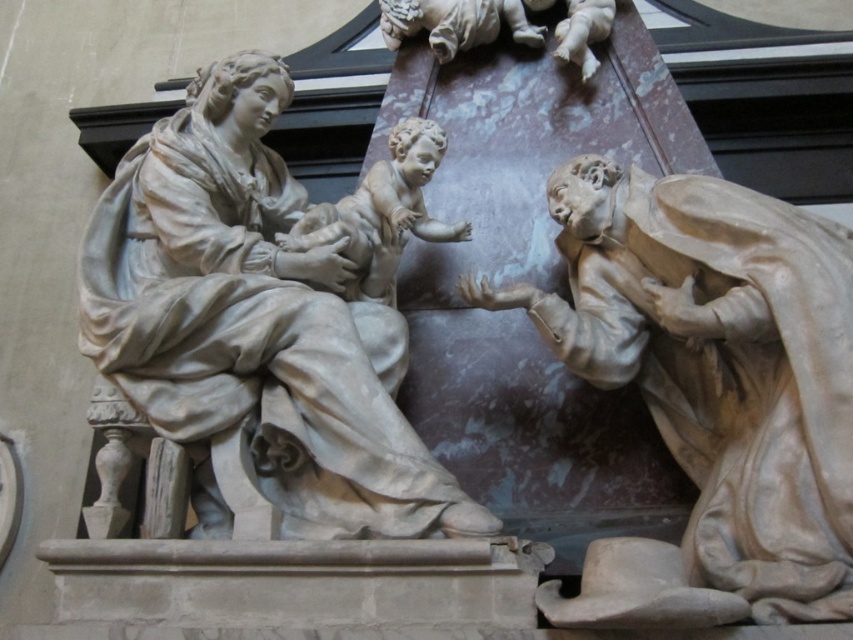
Does matte beige statue at right have a lesser height compared to matte stone baby at center?

In fact, matte beige statue at right may be taller than matte stone baby at center.

Who is shorter, matte beige statue at right or matte stone baby at center?

matte stone baby at center

Between point (804, 445) and point (363, 248), which one is positioned behind?

Positioned behind is point (363, 248).

Locate an element on the screen. The height and width of the screenshot is (640, 853). matte beige statue at right is located at coordinates (711, 388).

The image size is (853, 640). Describe the element at coordinates (711, 388) in the screenshot. I see `matte beige statue at right` at that location.

Who is more distant from viewer, (735, 352) or (207, 308)?

The point (207, 308) is more distant.

Identify the location of matte beige statue at right. (711, 388).

Does point (155, 401) come farther from viewer compared to point (509, 12)?

No, (155, 401) is in front of (509, 12).

Is white marble statue at upper left further to the viewer compared to smooth beige baby at upper center?

No.

Who is more forward, (363, 499) or (448, 24)?

Point (363, 499)

Where is `white marble statue at upper left`? white marble statue at upper left is located at coordinates (254, 323).